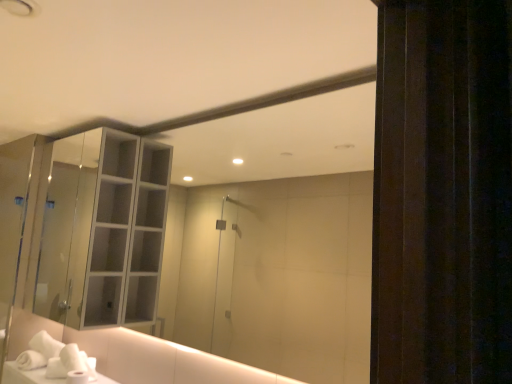
This screenshot has height=384, width=512. Identify the location of clear glass cabinet at upper left. (103, 230).

The image size is (512, 384). What do you see at coordinates (103, 230) in the screenshot? I see `clear glass cabinet at upper left` at bounding box center [103, 230].

What is the approximate height of clear glass cabinet at upper left?

It is 1.09 meters.

What do you see at coordinates (70, 363) in the screenshot? This screenshot has height=384, width=512. I see `white soft hand towel at lower left` at bounding box center [70, 363].

At what (x,y) coordinates should I click in order to perform the action: click on white soft hand towel at lower left. Please return your answer as a coordinate pair (x, y). The image size is (512, 384). Looking at the image, I should click on (70, 363).

I want to click on clear glass cabinet at upper left, so click(103, 230).

Considering the positions of objects clear glass cabinet at upper left and white soft hand towel at lower left in the image provided, who is more to the left, clear glass cabinet at upper left or white soft hand towel at lower left?

Positioned to the left is clear glass cabinet at upper left.

In the image, is clear glass cabinet at upper left positioned in front of or behind white soft hand towel at lower left?

In the image, clear glass cabinet at upper left appears in front of white soft hand towel at lower left.

Is point (41, 308) closer to viewer compared to point (83, 369)?

No, it is not.

From the image's perspective, is clear glass cabinet at upper left above or below white soft hand towel at lower left?

From the image's perspective, clear glass cabinet at upper left appears above white soft hand towel at lower left.

From a real-world perspective, is clear glass cabinet at upper left located beneath white soft hand towel at lower left?

No, from a real-world perspective, clear glass cabinet at upper left is not beneath white soft hand towel at lower left.

Considering the relative sizes of clear glass cabinet at upper left and white soft hand towel at lower left in the image provided, is clear glass cabinet at upper left thinner than white soft hand towel at lower left?

In fact, clear glass cabinet at upper left might be wider than white soft hand towel at lower left.

Considering the relative sizes of clear glass cabinet at upper left and white soft hand towel at lower left in the image provided, is clear glass cabinet at upper left shorter than white soft hand towel at lower left?

Incorrect, the height of clear glass cabinet at upper left does not fall short of that of white soft hand towel at lower left.

Which of these two, clear glass cabinet at upper left or white soft hand towel at lower left, is bigger?

clear glass cabinet at upper left is bigger.

Is white soft hand towel at lower left surrounded by clear glass cabinet at upper left?

No.

Are clear glass cabinet at upper left and white soft hand towel at lower left beside each other?

No, clear glass cabinet at upper left is not making contact with white soft hand towel at lower left.

Is clear glass cabinet at upper left positioned with its back to white soft hand towel at lower left?

No, white soft hand towel at lower left is not at the back of clear glass cabinet at upper left.

In the image, there is a white soft hand towel at lower left. Identify the location of cabinetry above it (from the image's perspective). The height and width of the screenshot is (384, 512). (103, 230).

Is white soft hand towel at lower left at the right side of clear glass cabinet at upper left?

Correct, you'll find white soft hand towel at lower left to the right of clear glass cabinet at upper left.

From the picture: Is white soft hand towel at lower left in front of or behind clear glass cabinet at upper left in the image?

Clearly, white soft hand towel at lower left is behind clear glass cabinet at upper left.

Considering the positions of point (68, 368) and point (123, 185), is point (68, 368) closer or farther from the camera than point (123, 185)?

Point (68, 368) is closer to the camera than point (123, 185).

From the picture: From the image's perspective, who appears lower, white soft hand towel at lower left or clear glass cabinet at upper left?

white soft hand towel at lower left.

From a real-world perspective, is white soft hand towel at lower left physically located above or below clear glass cabinet at upper left?

white soft hand towel at lower left is situated lower than clear glass cabinet at upper left in the real world.

Considering the relative sizes of white soft hand towel at lower left and clear glass cabinet at upper left in the image provided, is white soft hand towel at lower left thinner than clear glass cabinet at upper left?

Correct, the width of white soft hand towel at lower left is less than that of clear glass cabinet at upper left.

Based on the photo, from their relative heights in the image, would you say white soft hand towel at lower left is taller or shorter than clear glass cabinet at upper left?

Considering their sizes, white soft hand towel at lower left has less height than clear glass cabinet at upper left.

Who is bigger, white soft hand towel at lower left or clear glass cabinet at upper left?

clear glass cabinet at upper left.

Is white soft hand towel at lower left situated inside clear glass cabinet at upper left or outside?

white soft hand towel at lower left lies outside clear glass cabinet at upper left.

Is white soft hand towel at lower left placed right next to clear glass cabinet at upper left?

white soft hand towel at lower left and clear glass cabinet at upper left are not in contact.

Is white soft hand towel at lower left facing towards clear glass cabinet at upper left?

No.

What's the angular difference between white soft hand towel at lower left and clear glass cabinet at upper left's facing directions?

The facing directions of white soft hand towel at lower left and clear glass cabinet at upper left are 0.0544 degrees apart.

The image size is (512, 384). I want to click on cabinetry in front of the white soft hand towel at lower left, so click(x=103, y=230).

Find the location of a particular element. The width and height of the screenshot is (512, 384). hand towel below the clear glass cabinet at upper left (from the image's perspective) is located at coordinates (70, 363).

Locate an element on the screen. The height and width of the screenshot is (384, 512). cabinetry above the white soft hand towel at lower left (from a real-world perspective) is located at coordinates (103, 230).